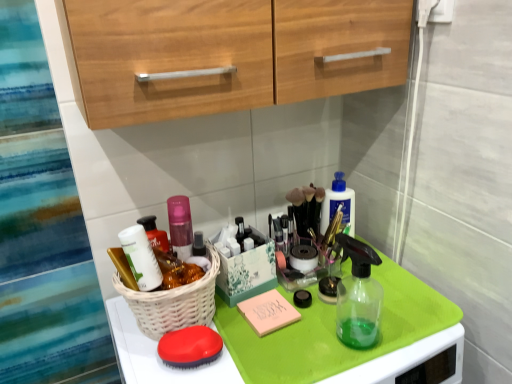
Question: From their relative heights in the image, would you say matte red brush at lower center is taller or shorter than white wicker basket at center?

Choices:
 (A) short
 (B) tall

Answer: (A)

Question: Considering the positions of matte red brush at lower center and white wicker basket at center in the image, is matte red brush at lower center bigger or smaller than white wicker basket at center?

Choices:
 (A) big
 (B) small

Answer: (B)

Question: Which object is positioned farthest from the matte white container at center left?

Choices:
 (A) matte red brush at lower center
 (B) white wicker basket at center

Answer: (A)

Question: Considering the real-world distances, which object is closest to the matte red brush at lower center?

Choices:
 (A) matte white container at center left
 (B) white wicker basket at center

Answer: (B)